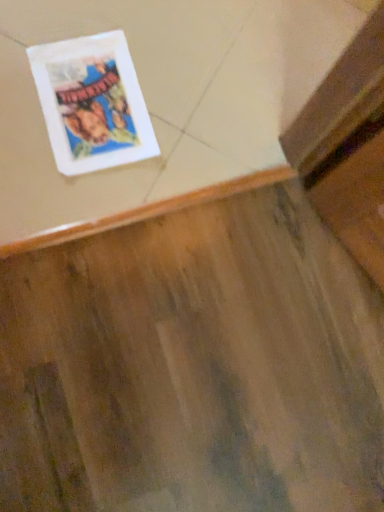
I want to click on free point above white paper at upper left (from a real-world perspective), so click(91, 99).